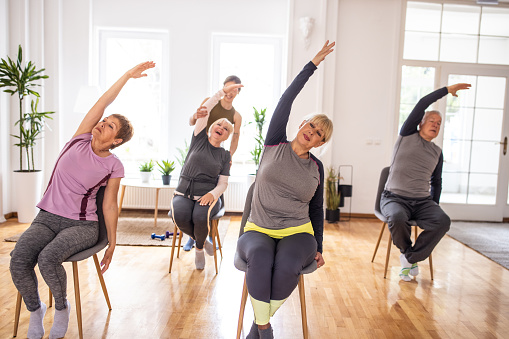
Locate an element on the screen. This screenshot has width=509, height=339. chair exercise group is located at coordinates (x=95, y=179), (x=207, y=173), (x=302, y=189), (x=420, y=176), (x=226, y=107).